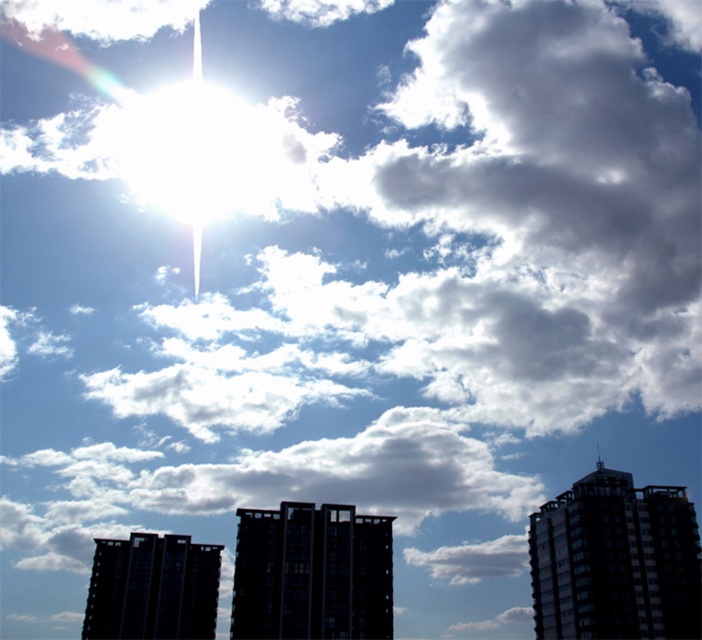
You are standing at the base of the tallest building in the scene and want to reach a point located at coordinates point (630, 477). If your walking speed is 1.5 meters per second, how many seconds will it take to reach that point?

The point (630, 477) is 122.64 meters away from the viewer. At a walking speed of 1.5 meters per second, it would take 122.64 divided by 1.5, which equals approximately 81.76 seconds to reach the point.

You are a drone operator trying to navigate a drone through the city. Your drone is currently above the bright sun near the top left corner. You need to fly it to the point marked at coordinates point (615,561). Which direction should you steer the drone to reach that point?

You should steer the drone to the right and downward to reach point (615,561), which is on the glassy reflective skyscraper at right.